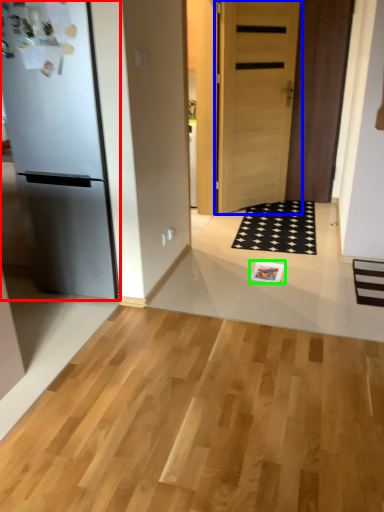
Question: Estimate the real-world distances between objects in this image. Which object is closer to refrigerator (highlighted by a red box), door (highlighted by a blue box) or magazine (highlighted by a green box)?

Choices:
 (A) door
 (B) magazine

Answer: (B)